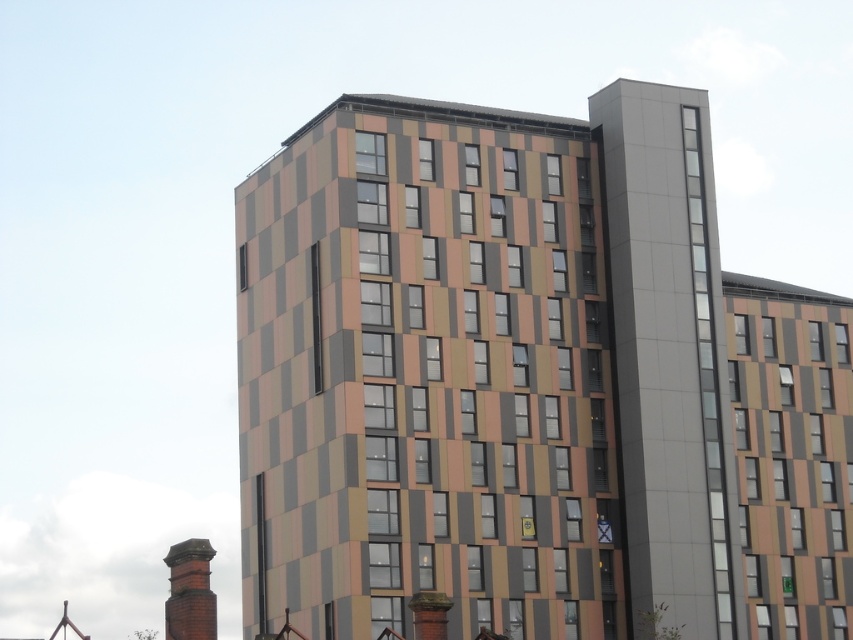
Question: Is the position of red brick chimney at lower left more distant than that of metallic rectangular clock at lower right?

Choices:
 (A) no
 (B) yes

Answer: (A)

Question: Which object is closer to the camera taking this photo?

Choices:
 (A) metallic rectangular clock at lower right
 (B) red brick chimney at lower left
 (C) smooth gray chimney at upper right

Answer: (B)

Question: Which of the following is the farthest from the observer?

Choices:
 (A) (265, 595)
 (B) (602, 538)

Answer: (A)

Question: Does multicolored textured building at center appear on the right side of metallic rectangular clock at lower right?

Choices:
 (A) yes
 (B) no

Answer: (B)

Question: In this image, where is multicolored textured building at center located relative to metallic rectangular clock at lower right?

Choices:
 (A) below
 (B) above

Answer: (B)

Question: Based on their relative distances, which object is nearer to the red brick chimney at lower left?

Choices:
 (A) metallic rectangular clock at lower right
 (B) multicolored textured building at center

Answer: (A)